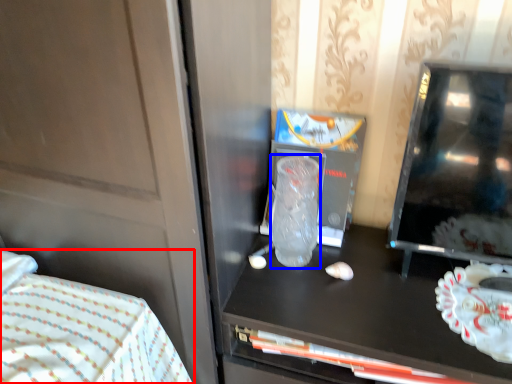
Question: Among these objects, which one is farthest to the camera, bed (highlighted by a red box) or glass vase (highlighted by a blue box)?

Choices:
 (A) bed
 (B) glass vase

Answer: (B)